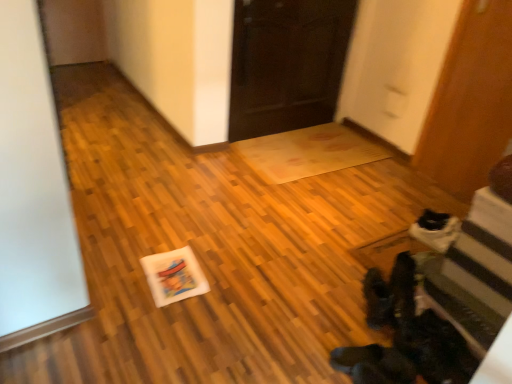
Where is `free space that is in between dark wood door at center, placed as the 2th door when sorted from right to left, and black suede boots at lower right`? This screenshot has width=512, height=384. free space that is in between dark wood door at center, placed as the 2th door when sorted from right to left, and black suede boots at lower right is located at coordinates (308, 192).